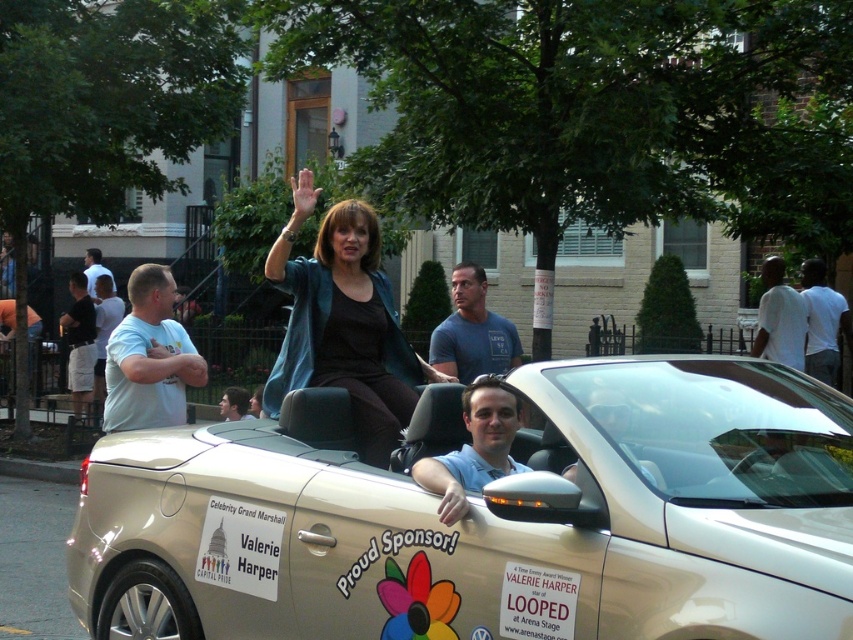
Question: In this image, where is gold metallic convertible at center located relative to matte blue jacket at center?

Choices:
 (A) left
 (B) right

Answer: (B)

Question: Which point is farther to the camera?

Choices:
 (A) gold metallic convertible at center
 (B) matte blue jacket at center

Answer: (B)

Question: Which point appears closest to the camera in this image?

Choices:
 (A) (289, 374)
 (B) (444, 410)

Answer: (B)

Question: From the image, what is the correct spatial relationship of gold metallic convertible at center in relation to matte blue jacket at center?

Choices:
 (A) right
 (B) left

Answer: (A)

Question: Is gold metallic convertible at center thinner than matte blue jacket at center?

Choices:
 (A) yes
 (B) no

Answer: (B)